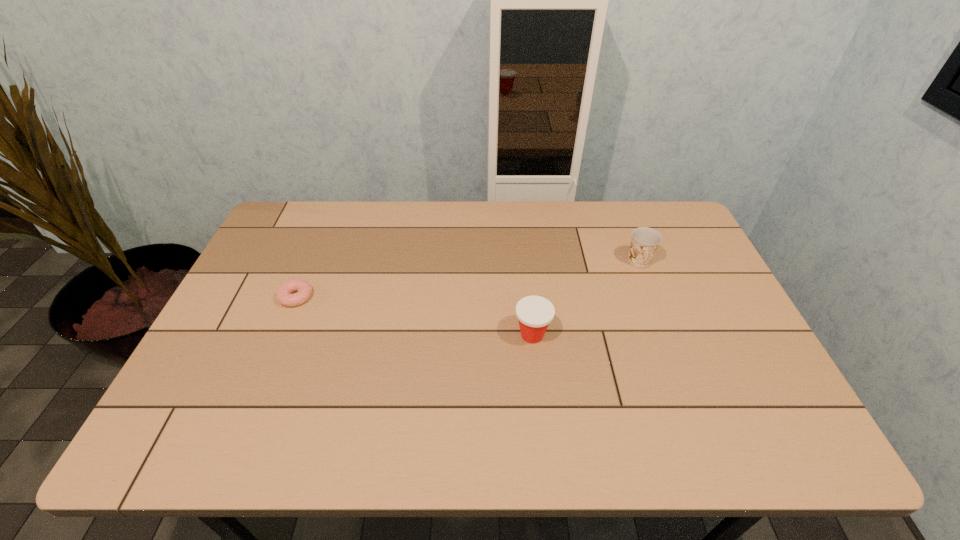
Identify the location of the farthest object. Image resolution: width=960 pixels, height=540 pixels. (645, 241).

Image resolution: width=960 pixels, height=540 pixels. In order to click on the right Dixie cup in this screenshot , I will do [x=645, y=241].

The height and width of the screenshot is (540, 960). Identify the location of the nearer Dixie cup. (534, 313).

At what (x,y) coordinates should I click in order to perform the action: click on the second object from right to left. Please return your answer as a coordinate pair (x, y). This screenshot has height=540, width=960. Looking at the image, I should click on (534, 313).

At what (x,y) coordinates should I click in order to perform the action: click on doughnut. Please return your answer as a coordinate pair (x, y). This screenshot has width=960, height=540. Looking at the image, I should click on (283, 294).

I want to click on the shortest object, so pyautogui.click(x=283, y=294).

The width and height of the screenshot is (960, 540). I want to click on free space located on the left of the rightmost object, so click(558, 262).

In order to click on vacant area located on the front of the second object from right to left in this screenshot , I will do `click(542, 434)`.

Find the location of `free region located on the back of the doughnut`. free region located on the back of the doughnut is located at coordinates (326, 224).

This screenshot has width=960, height=540. What are the coordinates of `object that is at the left edge` in the screenshot? It's located at (283, 294).